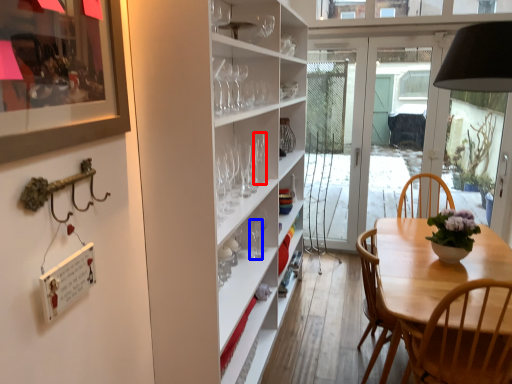
Question: Which point is closer to the camera, wine glass (highlighted by a red box) or wine glass (highlighted by a blue box)?

Choices:
 (A) wine glass
 (B) wine glass

Answer: (B)